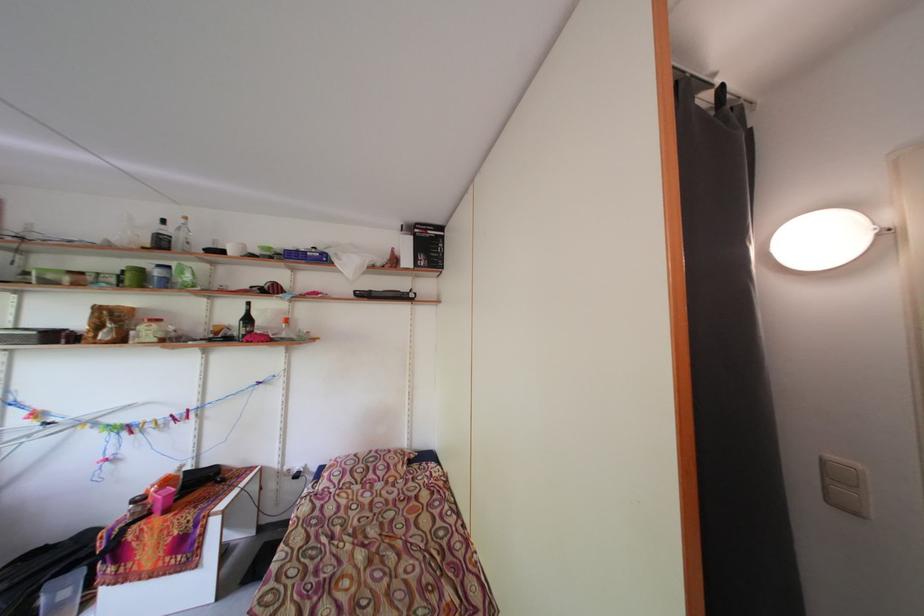
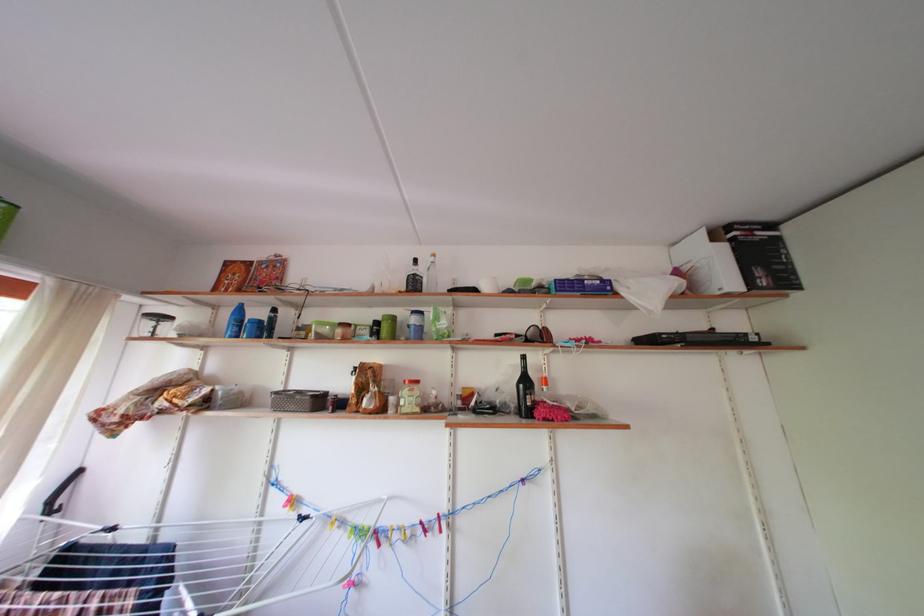
Where in the second image is the point corresponding to (256,325) from the first image?

(533, 387)